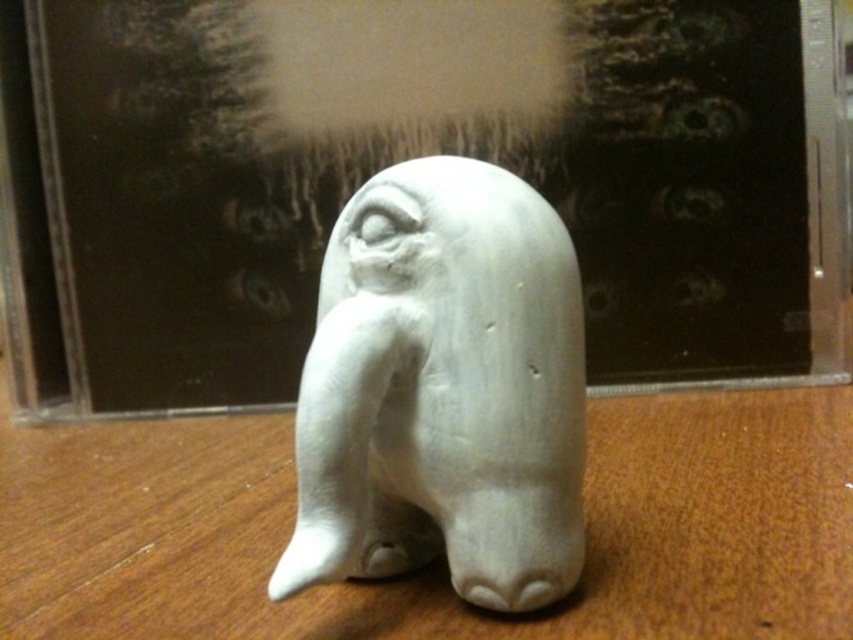
Question: Which point appears farthest from the camera in this image?

Choices:
 (A) (370, 248)
 (B) (50, 609)

Answer: (B)

Question: Is wooden table at center positioned in front of white matte elephant at center?

Choices:
 (A) no
 (B) yes

Answer: (B)

Question: Does wooden table at center have a greater width compared to white matte elephant at center?

Choices:
 (A) yes
 (B) no

Answer: (A)

Question: Considering the relative positions of wooden table at center and white matte elephant at center in the image provided, where is wooden table at center located with respect to white matte elephant at center?

Choices:
 (A) above
 (B) below

Answer: (B)

Question: Which point is closer to the camera?

Choices:
 (A) (497, 209)
 (B) (758, 577)

Answer: (A)